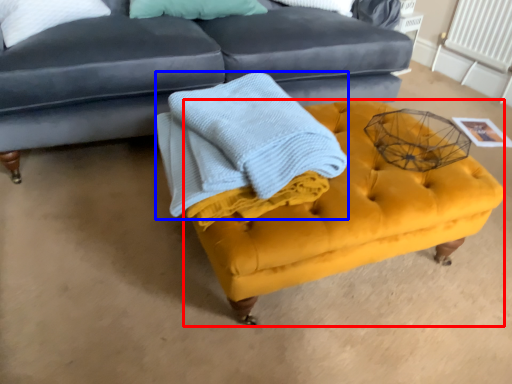
Question: Which point is further to the camera, swivel chair (highlighted by a red box) or blanket (highlighted by a blue box)?

Choices:
 (A) swivel chair
 (B) blanket

Answer: (A)